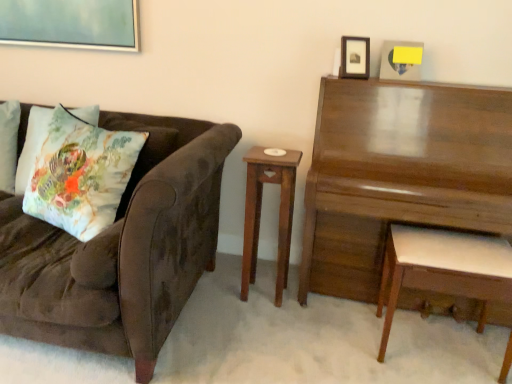
Question: Should I look upward or downward to see white wood stool at right?

Choices:
 (A) down
 (B) up

Answer: (A)

Question: Can white wood stool at right be found inside wooden picture frame at upper right, marked as the first picture frame in a left-to-right arrangement?

Choices:
 (A) yes
 (B) no

Answer: (B)

Question: Can you confirm if wooden picture frame at upper right, marked as the first picture frame in a left-to-right arrangement, is positioned to the left of white wood stool at right?

Choices:
 (A) no
 (B) yes

Answer: (B)

Question: Would you say wooden picture frame at upper right, marked as the first picture frame in a left-to-right arrangement, is outside white wood stool at right?

Choices:
 (A) no
 (B) yes

Answer: (B)

Question: Is wooden picture frame at upper right, marked as the 2th picture frame in a right-to-left arrangement, placed right next to white wood stool at right?

Choices:
 (A) yes
 (B) no

Answer: (B)

Question: Is wooden picture frame at upper right, marked as the 2th picture frame in a right-to-left arrangement, turned away from white wood stool at right?

Choices:
 (A) no
 (B) yes

Answer: (A)

Question: From the image's perspective, does wooden picture frame at upper right, marked as the first picture frame in a left-to-right arrangement, appear higher than white wood stool at right?

Choices:
 (A) yes
 (B) no

Answer: (A)

Question: Can you confirm if wooden picture frame at upper right, acting as the 1th picture frame starting from the right, is wider than glossy wood piano at upper right?

Choices:
 (A) no
 (B) yes

Answer: (A)

Question: Is there a large distance between wooden picture frame at upper right, acting as the 1th picture frame starting from the right, and glossy wood piano at upper right?

Choices:
 (A) no
 (B) yes

Answer: (A)

Question: Is wooden picture frame at upper right, acting as the 1th picture frame starting from the right, taller than glossy wood piano at upper right?

Choices:
 (A) no
 (B) yes

Answer: (A)

Question: Is wooden picture frame at upper right, acting as the 1th picture frame starting from the right, to the right of glossy wood piano at upper right from the viewer's perspective?

Choices:
 (A) no
 (B) yes

Answer: (A)

Question: Can you confirm if wooden picture frame at upper right, the 2th picture frame from the left, is positioned to the left of glossy wood piano at upper right?

Choices:
 (A) no
 (B) yes

Answer: (B)

Question: Does wooden picture frame at upper right, the 2th picture frame from the left, contain glossy wood piano at upper right?

Choices:
 (A) yes
 (B) no

Answer: (B)

Question: Can you confirm if wooden nightstand at center is wider than floral fabric pillow at left?

Choices:
 (A) yes
 (B) no

Answer: (B)